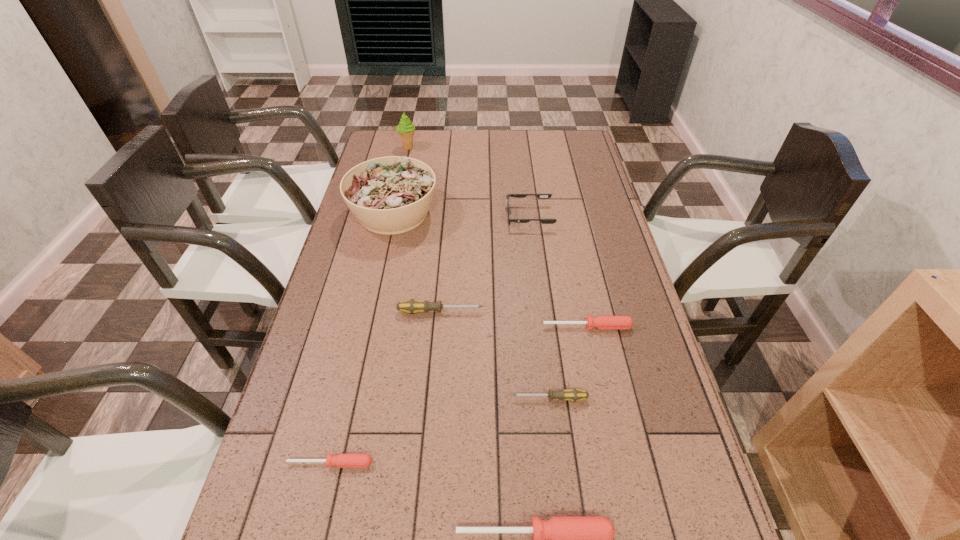
At what (x,y) coordinates should I click in order to perform the action: click on the second nearest object. Please return your answer as a coordinate pair (x, y). The width and height of the screenshot is (960, 540). Looking at the image, I should click on (341, 460).

You are a GUI agent. You are given a task and a screenshot of the screen. Output one action in this format:
    pyautogui.click(x=<x>, y=<y>)
    Task: Click on the leftmost red screwdriver
    This screenshot has height=540, width=960.
    Given the screenshot: What is the action you would take?
    pyautogui.click(x=341, y=460)

The width and height of the screenshot is (960, 540). I want to click on free space located 0.050m on the front of the farthest object, so coord(405,159).

The image size is (960, 540). Find the location of `free location located 0.150m on the back of the salad`. free location located 0.150m on the back of the salad is located at coordinates (404, 166).

Where is `free point located 0.080m on the temples of the sunglasses`? The image size is (960, 540). free point located 0.080m on the temples of the sunglasses is located at coordinates (483, 217).

Where is `blank space located on the temples of the sunglasses`? This screenshot has height=540, width=960. blank space located on the temples of the sunglasses is located at coordinates (408, 217).

Identify the location of vacant space situated on the temples of the sunglasses. The width and height of the screenshot is (960, 540). (391, 217).

The width and height of the screenshot is (960, 540). I want to click on blank area located at the tip of the bigger gray screwdriver, so click(x=562, y=312).

At what (x,y) coordinates should I click in order to perform the action: click on blank space located 0.090m on the back of the farthest red screwdriver. Please return your answer as a coordinate pair (x, y). This screenshot has width=960, height=540. Looking at the image, I should click on (581, 297).

Where is `free space located 0.250m at the tip of the right gray screwdriver`? free space located 0.250m at the tip of the right gray screwdriver is located at coordinates (407, 399).